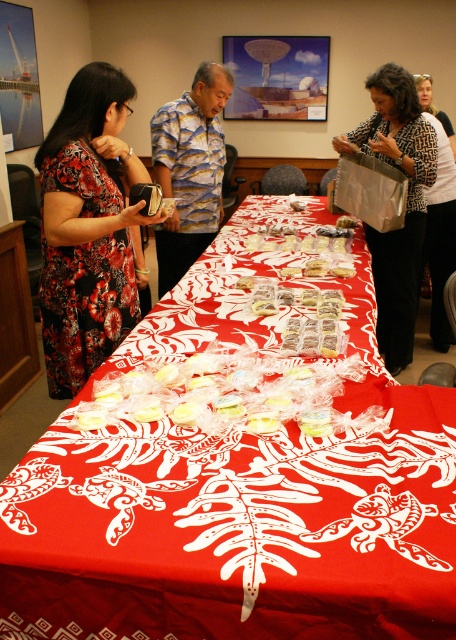
Question: Can you confirm if matte silver bag at center is bigger than leopard print jacket at upper center?

Choices:
 (A) no
 (B) yes

Answer: (B)

Question: Which of the following is the farthest from the observer?

Choices:
 (A) (414, 273)
 (B) (107, 291)
 (C) (83, 429)

Answer: (A)

Question: From the image, what is the correct spatial relationship of leopard print jacket at upper center in relation to white glossy cookies at center?

Choices:
 (A) below
 (B) above

Answer: (B)

Question: Which point is closer to the camera?

Choices:
 (A) (330, 269)
 (B) (393, 342)

Answer: (A)

Question: Which object is the closest to the white glossy cookies at center?

Choices:
 (A) red fabric table at center
 (B) matte silver bag at center

Answer: (B)

Question: Does leopard print jacket at upper center have a larger size compared to white glossy cookies at center?

Choices:
 (A) yes
 (B) no

Answer: (A)